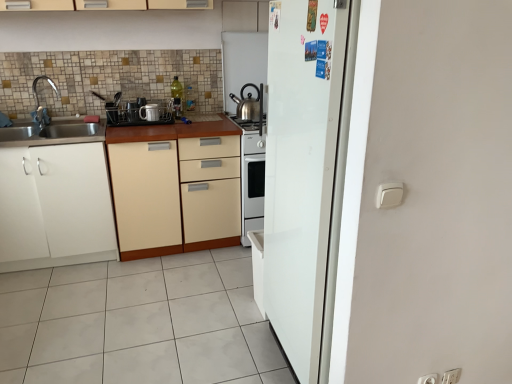
Find the location of a particular element. free space behind metallic silver pot at center, which is the 2th appliance in left-to-right order is located at coordinates (155, 119).